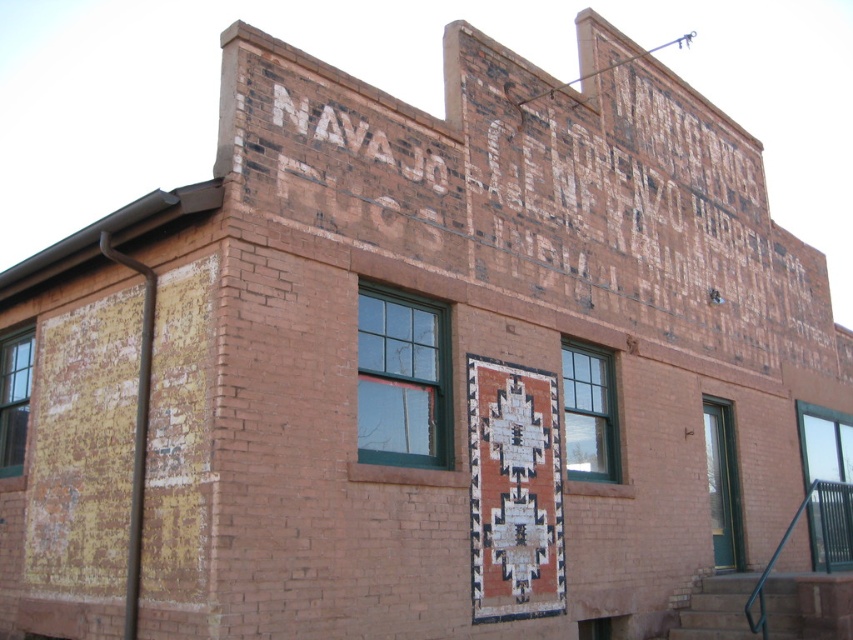
You are a delivery person trying to enter the building. You have a large package that requires a doorway at least 1 meter wide. The clear glass door at lower right and the green glass door at right are both potential entry points. Which door should you choose to ensure your package fits through?

The clear glass door at lower right might be wider than green glass door at right, so you should choose the clear glass door at lower right to ensure your package fits through.

You are standing in front of the two story brick building. You see two points marked on the facade. The first point is at coordinates point (825,424) and the second point is at point (709,467). Which point is closer to you?

Point (825,424) is further to the viewer than point (709,467), so the second point is closer to you.